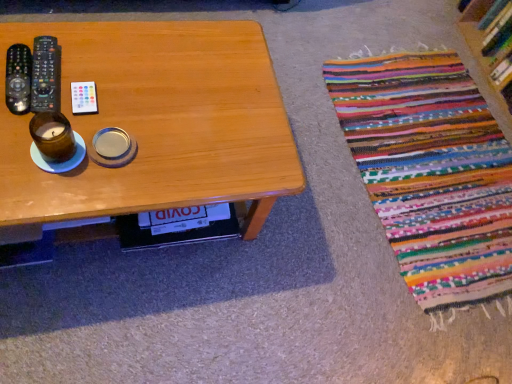
Locate an element on the screen. This screenshot has width=512, height=384. black plastic remote at left, the 2th remote control when ordered from left to right is located at coordinates (46, 75).

The image size is (512, 384). Describe the element at coordinates (46, 75) in the screenshot. I see `black plastic remote at left, the 2th remote control in the right-to-left sequence` at that location.

Describe the element at coordinates (431, 173) in the screenshot. I see `multicolored woven rug at lower right` at that location.

What do you see at coordinates (84, 98) in the screenshot?
I see `white plastic remote control at upper left, which is counted as the 1th remote control, starting from the right` at bounding box center [84, 98].

This screenshot has height=384, width=512. Describe the element at coordinates (52, 136) in the screenshot. I see `brown glass candle at left` at that location.

At what (x,y) coordinates should I click in order to perform the action: click on black plastic remote at left, the 2th remote control in the right-to-left sequence. Please return your answer as a coordinate pair (x, y). The height and width of the screenshot is (384, 512). Looking at the image, I should click on coord(46,75).

Is black plastic remote at left, the 2th remote control when ordered from left to right, at the back of brown glass candle at left?

No, black plastic remote at left, the 2th remote control when ordered from left to right, is not at the back of brown glass candle at left.

From the image's perspective, count 3rd remote controls upward from the brown glass candle at left and point to it. Please provide its 2D coordinates.

[(46, 75)]

Is brown glass candle at left beside black plastic remote at left, the 2th remote control in the right-to-left sequence?

Yes, brown glass candle at left is next to black plastic remote at left, the 2th remote control in the right-to-left sequence.

Considering the relative sizes of brown glass candle at left and black plastic remote at left, the 2th remote control when ordered from left to right, in the image provided, is brown glass candle at left thinner than black plastic remote at left, the 2th remote control when ordered from left to right,?

Yes, brown glass candle at left is thinner than black plastic remote at left, the 2th remote control when ordered from left to right.

Is multicolored woven rug at lower right facing towards black plastic remote at left, the 2th remote control in the right-to-left sequence?

No.

Can you confirm if multicolored woven rug at lower right is thinner than black plastic remote at left, the 2th remote control when ordered from left to right?

Incorrect, the width of multicolored woven rug at lower right is not less than that of black plastic remote at left, the 2th remote control when ordered from left to right.

How many degrees apart are the facing directions of multicolored woven rug at lower right and black plastic remote at left, the 2th remote control in the right-to-left sequence?

The facing directions of multicolored woven rug at lower right and black plastic remote at left, the 2th remote control in the right-to-left sequence, are 93 degrees apart.

Considering the points (458, 256) and (42, 78), which point is in front, point (458, 256) or point (42, 78)?

The point (42, 78) is closer to the camera.

Could you tell me if brown glass candle at left is facing wooden bookshelf at upper right?

No, brown glass candle at left does not turn towards wooden bookshelf at upper right.

Is brown glass candle at left taller or shorter than wooden bookshelf at upper right?

In the image, brown glass candle at left appears to be shorter than wooden bookshelf at upper right.

From the image's perspective, would you say brown glass candle at left is shown under wooden bookshelf at upper right?

Yes.

Is wooden table at center in contact with multicolored woven rug at lower right?

No, wooden table at center is not in contact with multicolored woven rug at lower right.

Looking at the image, does wooden table at center seem bigger or smaller compared to multicolored woven rug at lower right?

In the image, wooden table at center appears to be larger than multicolored woven rug at lower right.

From their relative heights in the image, would you say wooden table at center is taller or shorter than multicolored woven rug at lower right?

Considering their sizes, wooden table at center has more height than multicolored woven rug at lower right.

Is wooden table at center closer to camera compared to multicolored woven rug at lower right?

Yes, wooden table at center is in front of multicolored woven rug at lower right.

Between black plastic remote at left, the 2th remote control when ordered from left to right, and brown glass candle at left, which one appears on the right side from the viewer's perspective?

Positioned to the right is brown glass candle at left.

Between black plastic remote at left, the 2th remote control in the right-to-left sequence, and brown glass candle at left, which one has smaller size?

black plastic remote at left, the 2th remote control in the right-to-left sequence.

From a real-world perspective, is black plastic remote at left, the 2th remote control in the right-to-left sequence, located beneath brown glass candle at left?

Yes, from a real-world perspective, black plastic remote at left, the 2th remote control in the right-to-left sequence, is beneath brown glass candle at left.

In the scene shown: From the image's perspective, which one is positioned lower, black plastic remote control at left, positioned as the 3th remote control in right-to-left order, or brown glass candle at left?

brown glass candle at left is shown below in the image.

Considering the sizes of black plastic remote control at left, which appears as the 1th remote control when viewed from the left, and brown glass candle at left in the image, is black plastic remote control at left, which appears as the 1th remote control when viewed from the left, bigger or smaller than brown glass candle at left?

Considering their sizes, black plastic remote control at left, which appears as the 1th remote control when viewed from the left, takes up less space than brown glass candle at left.

Find the location of `coffee cup that is below the black plastic remote control at left, positioned as the 3th remote control in right-to-left order (from the image's perspective)`. coffee cup that is below the black plastic remote control at left, positioned as the 3th remote control in right-to-left order (from the image's perspective) is located at coordinates (52, 136).

Between white plastic remote control at upper left, which is counted as the 1th remote control, starting from the right, and wooden table at center, which one appears on the left side from the viewer's perspective?

Positioned to the left is white plastic remote control at upper left, which is counted as the 1th remote control, starting from the right.

Is white plastic remote control at upper left, the third remote control when ordered from left to right, aimed at wooden table at center?

No, white plastic remote control at upper left, the third remote control when ordered from left to right, does not turn towards wooden table at center.

Would you say white plastic remote control at upper left, the third remote control when ordered from left to right, is outside wooden table at center?

That's correct, white plastic remote control at upper left, the third remote control when ordered from left to right, is outside of wooden table at center.

You are a GUI agent. You are given a task and a screenshot of the screen. Output one action in this format:
    pyautogui.click(x=<x>, y=<y>)
    Task: Click on the table directly beneath the white plastic remote control at upper left, the third remote control when ordered from left to right (from a real-world perspective)
    This screenshot has height=384, width=512.
    Given the screenshot: What is the action you would take?
    pyautogui.click(x=156, y=123)

From the brown glass candle at left, count the 1st remote control to the left and point to it. Please provide its 2D coordinates.

[(46, 75)]

This screenshot has height=384, width=512. I want to click on blanket on the right of black plastic remote at left, the 2th remote control in the right-to-left sequence, so click(431, 173).

Which object lies nearer to the anchor point wooden bookshelf at upper right, white plastic remote control at upper left, the third remote control when ordered from left to right, or brown glass candle at left?

white plastic remote control at upper left, the third remote control when ordered from left to right.

Considering their positions, is white plastic remote control at upper left, which is counted as the 1th remote control, starting from the right, positioned closer to multicolored woven rug at lower right than black plastic remote at left, the 2th remote control when ordered from left to right?

Among the two, white plastic remote control at upper left, which is counted as the 1th remote control, starting from the right, is located nearer to multicolored woven rug at lower right.

From the image, which object appears to be farther from black plastic remote control at left, positioned as the 3th remote control in right-to-left order, wooden table at center or brown glass candle at left?

wooden table at center is positioned further to the anchor black plastic remote control at left, positioned as the 3th remote control in right-to-left order.

From the image, which object appears to be nearer to white plastic remote control at upper left, which is counted as the 1th remote control, starting from the right, multicolored woven rug at lower right or brown glass candle at left?

Among the two, brown glass candle at left is located nearer to white plastic remote control at upper left, which is counted as the 1th remote control, starting from the right.

Which object lies further to the anchor point black plastic remote at left, the 2th remote control when ordered from left to right, brown glass candle at left or wooden bookshelf at upper right?

wooden bookshelf at upper right lies further to black plastic remote at left, the 2th remote control when ordered from left to right, than the other object.

Looking at the image, which one is located closer to wooden table at center, black plastic remote control at left, which appears as the 1th remote control when viewed from the left, or wooden bookshelf at upper right?

Among the two, black plastic remote control at left, which appears as the 1th remote control when viewed from the left, is located nearer to wooden table at center.

From the image, which object appears to be nearer to black plastic remote control at left, which appears as the 1th remote control when viewed from the left, white plastic remote control at upper left, which is counted as the 1th remote control, starting from the right, or brown glass candle at left?

brown glass candle at left is positioned closer to the anchor black plastic remote control at left, which appears as the 1th remote control when viewed from the left.

When comparing their distances from multicolored woven rug at lower right, does black plastic remote control at left, positioned as the 3th remote control in right-to-left order, or wooden bookshelf at upper right seem closer?

wooden bookshelf at upper right is positioned closer to the anchor multicolored woven rug at lower right.

Locate an element on the screen. This screenshot has width=512, height=384. remote control between black plastic remote control at left, positioned as the 3th remote control in right-to-left order, and white plastic remote control at upper left, the third remote control when ordered from left to right, from left to right is located at coordinates (46, 75).

Image resolution: width=512 pixels, height=384 pixels. I want to click on remote control between black plastic remote control at left, which appears as the 1th remote control when viewed from the left, and brown glass candle at left from top to bottom, so click(84, 98).

Where is `table situated between black plastic remote control at left, which appears as the 1th remote control when viewed from the left, and multicolored woven rug at lower right from left to right`? The height and width of the screenshot is (384, 512). table situated between black plastic remote control at left, which appears as the 1th remote control when viewed from the left, and multicolored woven rug at lower right from left to right is located at coordinates (156, 123).

The height and width of the screenshot is (384, 512). In order to click on table situated between brown glass candle at left and wooden bookshelf at upper right from left to right in this screenshot , I will do `click(156, 123)`.